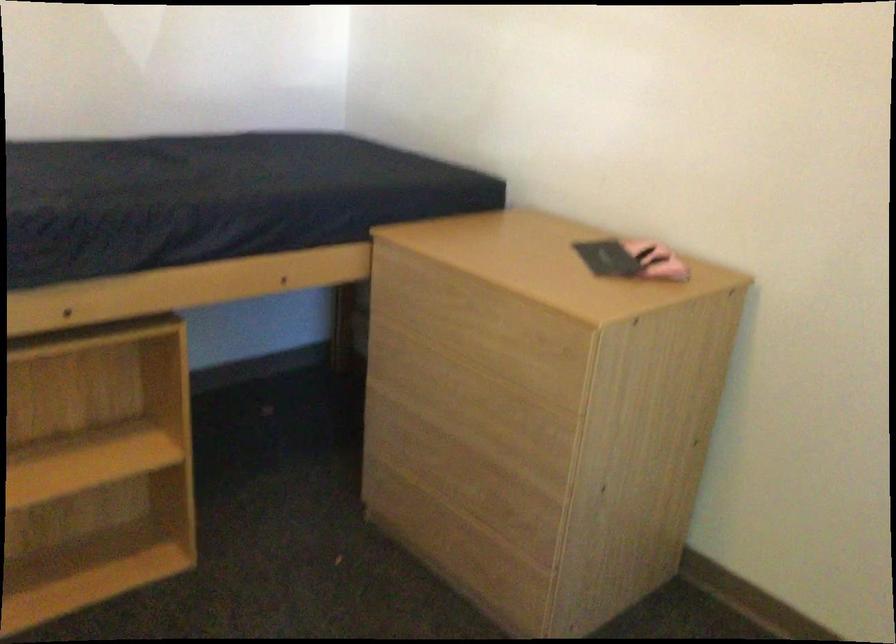
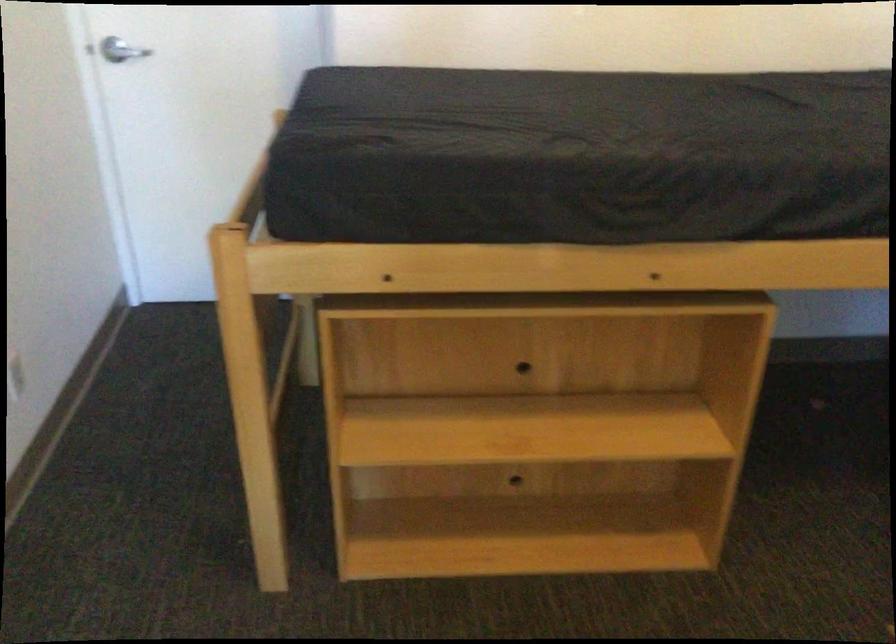
Question: The camera is either moving clockwise (left) or counter-clockwise (right) around the object. The first image is from the beginning of the video and the second image is from the end. Is the camera moving left or right when shooting the video?

Choices:
 (A) Left
 (B) Right

Answer: (B)